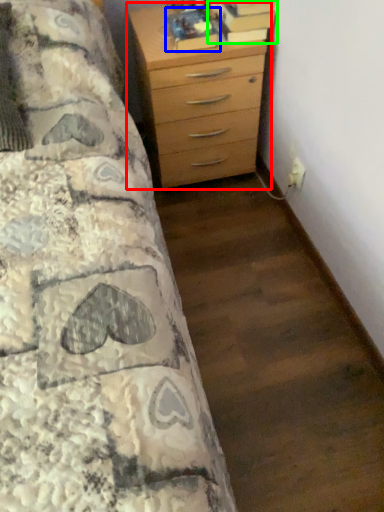
Question: Based on their relative distances, which object is farther from chest of drawers (highlighted by a red box)? Choose from book (highlighted by a blue box) and book (highlighted by a green box).

Choices:
 (A) book
 (B) book

Answer: (B)